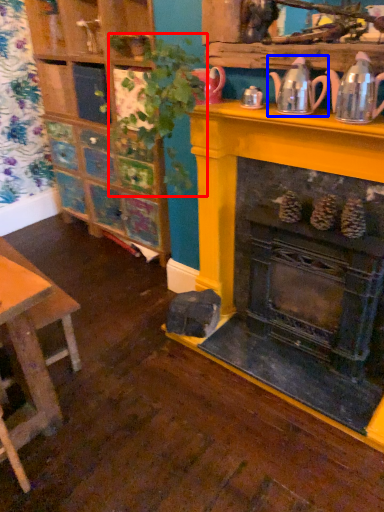
Question: Among these objects, which one is farthest to the camera, plant (highlighted by a red box) or tea pot (highlighted by a blue box)?

Choices:
 (A) plant
 (B) tea pot

Answer: (B)